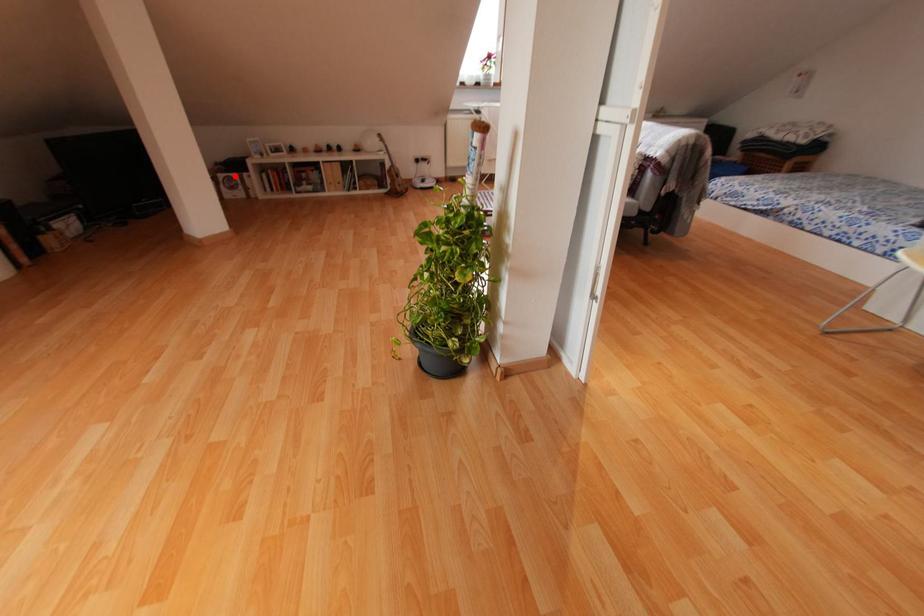
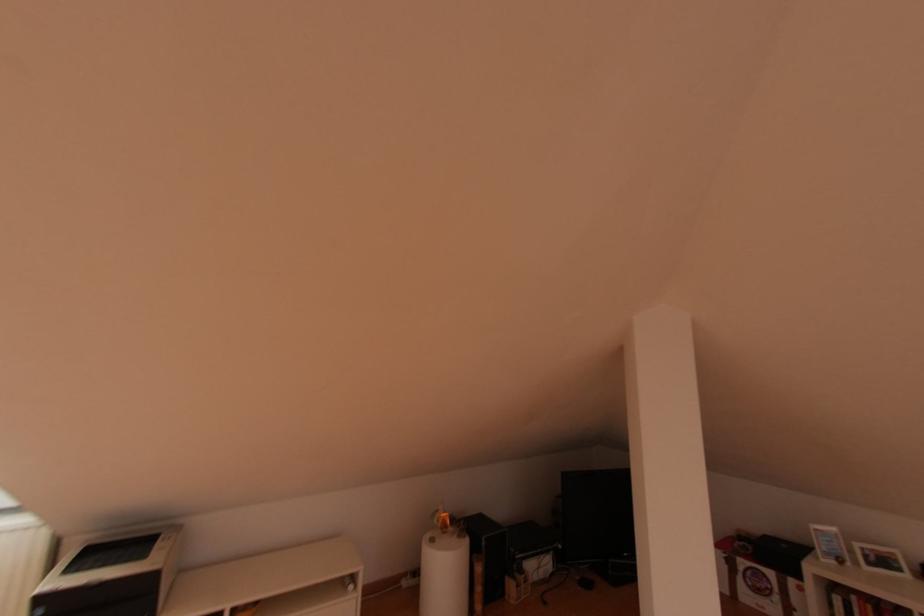
Question: I am providing you with two images of the same scene from different viewpoints. Image1 has a red point marked. In image2, the corresponding 3D location appears at what relative position? Reply with the corresponding letter.

Choices:
 (A) Closer
 (B) Farther

Answer: (A)